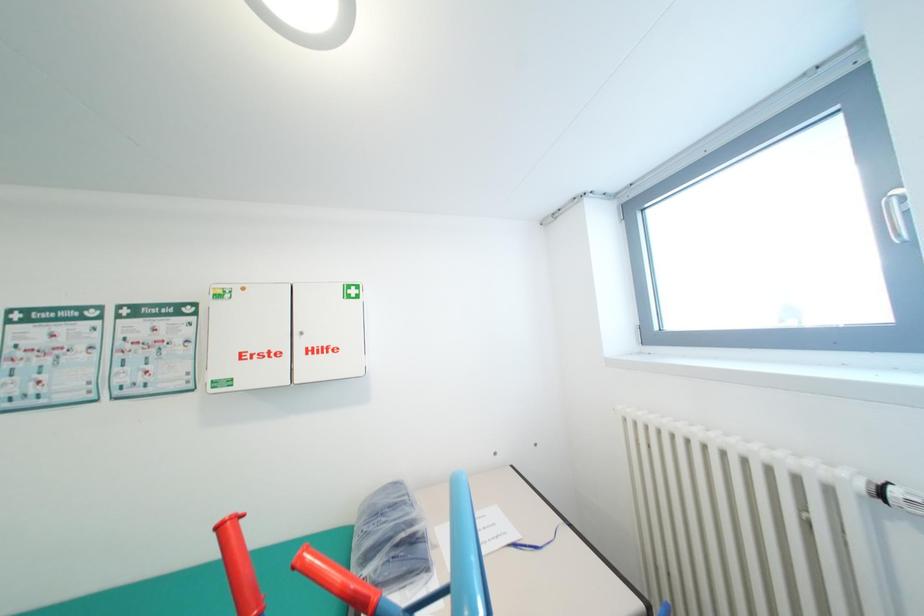
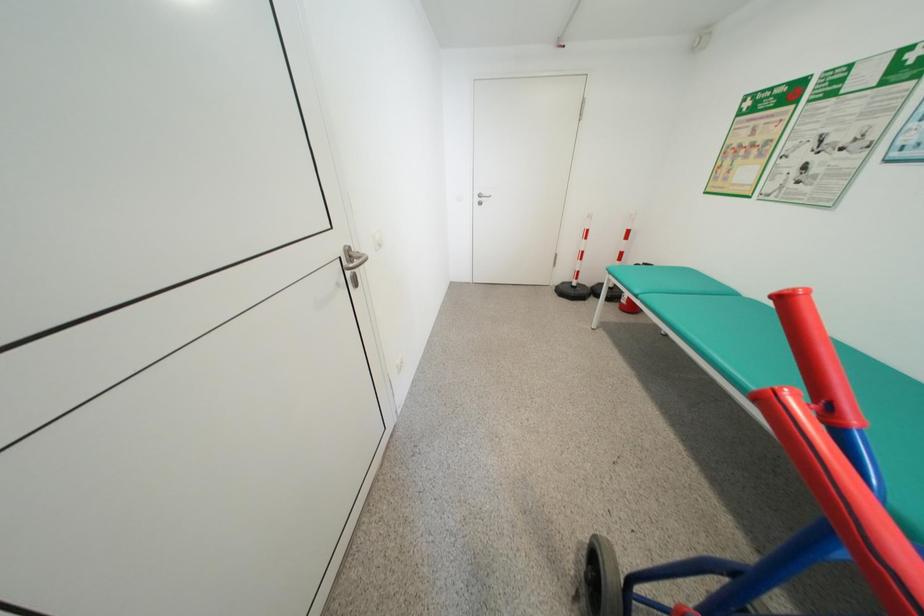
First-person continuous shooting, in which direction is the camera rotating?

The rotation direction of the camera is left-down.